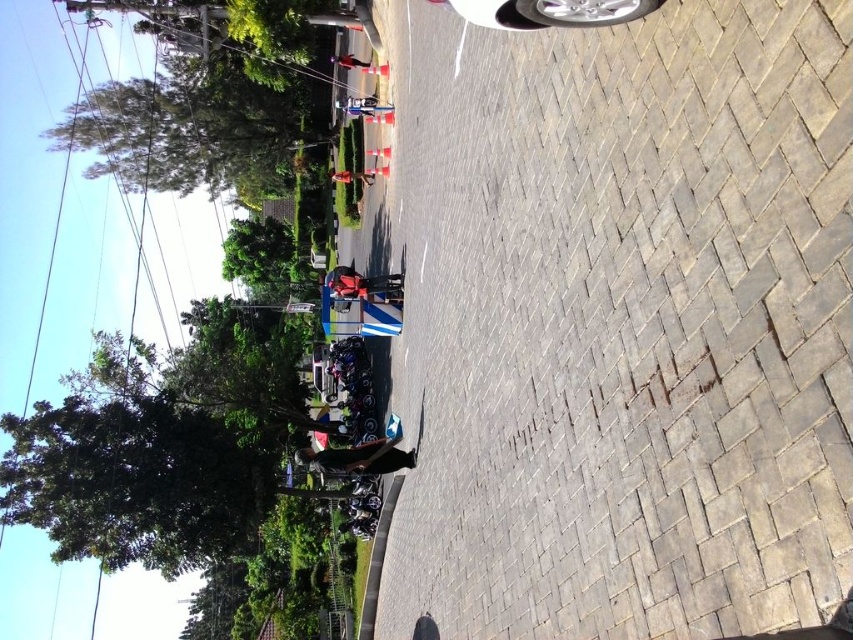
Question: Is the position of silver metallic car at upper center less distant than that of shiny red jacket at center?

Choices:
 (A) no
 (B) yes

Answer: (B)

Question: Which object is closer to the camera taking this photo?

Choices:
 (A) silver metallic car at upper center
 (B) shiny red jacket at center

Answer: (A)

Question: Is matte black helmet at center thinner than shiny red jacket at center?

Choices:
 (A) yes
 (B) no

Answer: (A)

Question: Which object is the farthest from the shiny red jacket at center?

Choices:
 (A) dark brown leather jacket at lower center
 (B) matte black helmet at center
 (C) matte black jacket at center
 (D) silver metallic car at upper center

Answer: (D)

Question: Is dark brown leather jacket at lower center further to camera compared to shiny red jacket at center?

Choices:
 (A) yes
 (B) no

Answer: (B)

Question: Estimate the real-world distances between objects in this image. Which object is closer to the matte black helmet at center?

Choices:
 (A) dark brown leather jacket at lower center
 (B) silver metallic car at upper center
 (C) matte black jacket at center
 (D) shiny red jacket at center

Answer: (A)